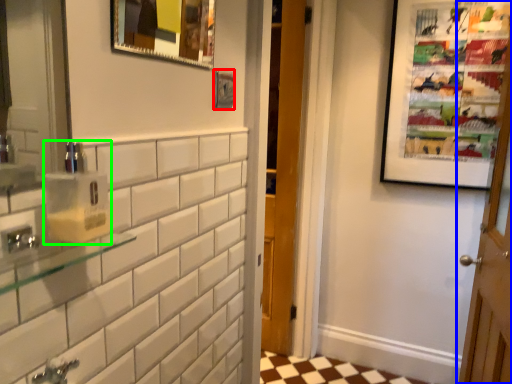
Question: Based on their relative distances, which object is nearer to picture frame (highlighted by a red box)? Choose from door (highlighted by a blue box) and soap dispenser (highlighted by a green box).

Choices:
 (A) door
 (B) soap dispenser

Answer: (B)